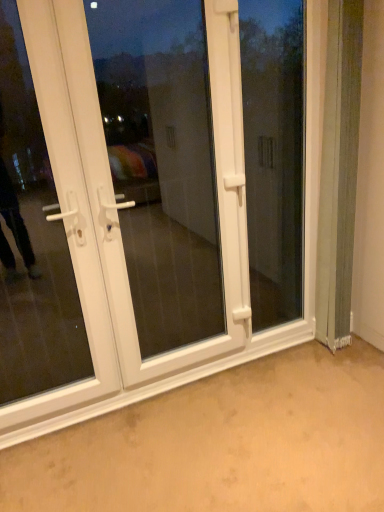
The width and height of the screenshot is (384, 512). What do you see at coordinates (171, 181) in the screenshot? I see `white plastic screen door at center` at bounding box center [171, 181].

Describe the element at coordinates (273, 154) in the screenshot. I see `transparent glass window at center` at that location.

The width and height of the screenshot is (384, 512). What do you see at coordinates (66, 220) in the screenshot?
I see `white plastic door at left, which is the second door from right to left` at bounding box center [66, 220].

Where is `white plastic screen door at center`? Image resolution: width=384 pixels, height=512 pixels. white plastic screen door at center is located at coordinates (171, 181).

Could you tell me if transparent glass window at center is facing white plastic screen door at center?

No, transparent glass window at center is not facing towards white plastic screen door at center.

From a real-world perspective, between transparent glass window at center and white plastic screen door at center, who is vertically higher?

From a 3D spatial view, white plastic screen door at center is above.

Is transparent glass window at center not within white plastic screen door at center?

transparent glass window at center lies outside white plastic screen door at center's area.

Do you think white plastic door at left, which is the second door from right to left, is within transparent glass window at center, or outside of it?

white plastic door at left, which is the second door from right to left, is not inside transparent glass window at center, it's outside.

From the image's perspective, relative to transparent glass window at center, is white plastic door at left, which is the second door from right to left, above or below?

white plastic door at left, which is the second door from right to left, is situated lower than transparent glass window at center in the image.

Can you confirm if white plastic door at left, which ranks as the first door in left-to-right order, is wider than transparent glass window at center?

Correct, the width of white plastic door at left, which ranks as the first door in left-to-right order, exceeds that of transparent glass window at center.

Are white plastic door at left, which is the second door from right to left, and transparent glass window at center making contact?

No, white plastic door at left, which is the second door from right to left, is not in contact with transparent glass window at center.

Is transparent glass window at center far away from white plastic door at left, which ranks as the first door in left-to-right order?

Absolutely, transparent glass window at center is distant from white plastic door at left, which ranks as the first door in left-to-right order.

From a real-world perspective, between transparent glass window at center and white plastic door at left, which is the second door from right to left, who is vertically lower?

In real-world perspective, transparent glass window at center is lower.

Does transparent glass window at center have a larger size compared to white plastic door at left, which ranks as the first door in left-to-right order?

Actually, transparent glass window at center might be smaller than white plastic door at left, which ranks as the first door in left-to-right order.

Does point (210, 52) come in front of point (123, 146)?

Yes, it is.

Between white plastic door at center, the 1th door when ordered from right to left, and white plastic screen door at center, which one has smaller width?

white plastic door at center, the 1th door when ordered from right to left.

Considering the sizes of white plastic door at center, the 1th door when ordered from right to left, and white plastic screen door at center in the image, is white plastic door at center, the 1th door when ordered from right to left, taller or shorter than white plastic screen door at center?

In the image, white plastic door at center, the 1th door when ordered from right to left, appears to be taller than white plastic screen door at center.

Could you tell me if white plastic door at center, which is counted as the second door, starting from the left, is facing transparent glass window at center?

Yes, white plastic door at center, which is counted as the second door, starting from the left, is facing transparent glass window at center.

Considering the positions of objects white plastic door at center, which is counted as the second door, starting from the left, and transparent glass window at center in the image provided, who is more to the left, white plastic door at center, which is counted as the second door, starting from the left, or transparent glass window at center?

From the viewer's perspective, white plastic door at center, which is counted as the second door, starting from the left, appears more on the left side.

Does white plastic door at center, which is counted as the second door, starting from the left, have a lesser width compared to transparent glass window at center?

No, white plastic door at center, which is counted as the second door, starting from the left, is not thinner than transparent glass window at center.

Which object is further away from the camera taking this photo, white plastic screen door at center or white plastic door at center, the 1th door when ordered from right to left?

Positioned behind is white plastic screen door at center.

How many degrees apart are the facing directions of white plastic screen door at center and white plastic door at center, the 1th door when ordered from right to left?

The angular difference between white plastic screen door at center and white plastic door at center, the 1th door when ordered from right to left, is 0.272 degrees.

Between point (147, 371) and point (255, 356), which one is positioned in front?

The point (147, 371) is closer to the camera.

Considering the positions of objects white plastic screen door at center and transparent glass window at center in the image provided, who is in front, white plastic screen door at center or transparent glass window at center?

white plastic screen door at center is closer to the camera.

Considering the sizes of objects white plastic screen door at center and transparent glass window at center in the image provided, who is shorter, white plastic screen door at center or transparent glass window at center?

transparent glass window at center.

Would you say transparent glass window at center is part of white plastic screen door at center's contents?

No, transparent glass window at center is not a part of white plastic screen door at center.

This screenshot has width=384, height=512. I want to click on screen door below the transparent glass window at center (from the image's perspective), so click(x=171, y=181).

Where is `screen door that appears below the transparent glass window at center (from the image's perspective)`? This screenshot has width=384, height=512. screen door that appears below the transparent glass window at center (from the image's perspective) is located at coordinates (171, 181).

The width and height of the screenshot is (384, 512). I want to click on door that is the 2nd one when counting forward from the transparent glass window at center, so tap(66, 220).

Based on the photo, considering their positions, is transparent glass window at center positioned further to white plastic door at center, which is counted as the second door, starting from the left, than white plastic screen door at center?

white plastic screen door at center is further to white plastic door at center, which is counted as the second door, starting from the left.

In the scene shown: Looking at the image, which one is located closer to white plastic door at center, which is counted as the second door, starting from the left, white plastic door at left, which is the second door from right to left, or transparent glass window at center?

white plastic door at left, which is the second door from right to left.

Looking at the image, which one is located further to white plastic door at center, which is counted as the second door, starting from the left, white plastic screen door at center or transparent glass window at center?

The object further to white plastic door at center, which is counted as the second door, starting from the left, is white plastic screen door at center.

From the picture: Which object lies further to the anchor point white plastic door at left, which is the second door from right to left, white plastic screen door at center or transparent glass window at center?

Based on the image, white plastic screen door at center appears to be further to white plastic door at left, which is the second door from right to left.

When comparing their distances from transparent glass window at center, does white plastic screen door at center or white plastic door at left, which is the second door from right to left, seem further?

white plastic door at left, which is the second door from right to left.

Considering their positions, is white plastic door at center, which is counted as the second door, starting from the left, positioned closer to white plastic door at left, which ranks as the first door in left-to-right order, than white plastic screen door at center?

Based on the image, white plastic door at center, which is counted as the second door, starting from the left, appears to be nearer to white plastic door at left, which ranks as the first door in left-to-right order.

When comparing their distances from white plastic door at left, which is the second door from right to left, does transparent glass window at center or white plastic door at center, the 1th door when ordered from right to left, seem closer?

white plastic door at center, the 1th door when ordered from right to left, lies closer to white plastic door at left, which is the second door from right to left, than the other object.

Estimate the real-world distances between objects in this image. Which object is further from transparent glass window at center, white plastic door at center, the 1th door when ordered from right to left, or white plastic screen door at center?

white plastic screen door at center is further to transparent glass window at center.

Identify the location of screen door between white plastic door at center, which is counted as the second door, starting from the left, and transparent glass window at center from left to right. (171, 181).

I want to click on door located between white plastic door at left, which is the second door from right to left, and transparent glass window at center in the left-right direction, so click(118, 219).

Identify the location of door between white plastic door at left, which ranks as the first door in left-to-right order, and white plastic screen door at center, in the horizontal direction. (118, 219).

Find the location of a particular element. This screenshot has width=384, height=512. screen door between white plastic door at left, which is the second door from right to left, and transparent glass window at center from left to right is located at coordinates [171, 181].